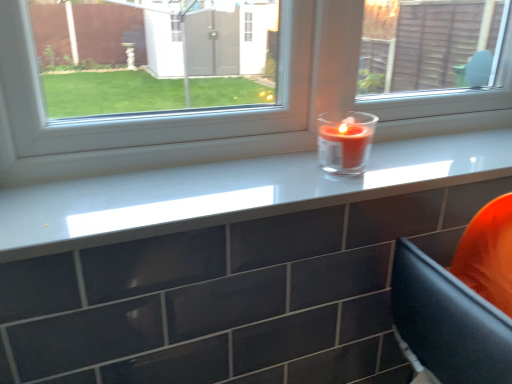
Question: From a real-world perspective, is transparent glass candle at center positioned under matte glass candle at upper center based on gravity?

Choices:
 (A) yes
 (B) no

Answer: (B)

Question: Is transparent glass candle at center bigger than matte glass candle at upper center?

Choices:
 (A) no
 (B) yes

Answer: (B)

Question: Is transparent glass candle at center not inside matte glass candle at upper center?

Choices:
 (A) yes
 (B) no

Answer: (A)

Question: Is transparent glass candle at center beside matte glass candle at upper center?

Choices:
 (A) yes
 (B) no

Answer: (B)

Question: Is transparent glass candle at center looking in the opposite direction of matte glass candle at upper center?

Choices:
 (A) no
 (B) yes

Answer: (A)

Question: Considering the positions of transparent glass candle at center and translucent glass candle at center in the image, is transparent glass candle at center bigger or smaller than translucent glass candle at center?

Choices:
 (A) big
 (B) small

Answer: (A)

Question: From the image's perspective, relative to translucent glass candle at center, is transparent glass candle at center above or below?

Choices:
 (A) above
 (B) below

Answer: (A)

Question: From a real-world perspective, is transparent glass candle at center physically located above or below translucent glass candle at center?

Choices:
 (A) above
 (B) below

Answer: (A)

Question: Considering the positions of transparent glass candle at center and translucent glass candle at center in the image, is transparent glass candle at center wider or thinner than translucent glass candle at center?

Choices:
 (A) wide
 (B) thin

Answer: (B)

Question: Visually, is matte glass candle at upper center positioned to the left or to the right of transparent glass candle at center?

Choices:
 (A) left
 (B) right

Answer: (B)

Question: Considering the positions of point (261, 165) and point (135, 137), is point (261, 165) closer or farther from the camera than point (135, 137)?

Choices:
 (A) closer
 (B) farther

Answer: (B)

Question: From the image's perspective, is matte glass candle at upper center located above or below transparent glass candle at center?

Choices:
 (A) above
 (B) below

Answer: (B)

Question: From a real-world perspective, is matte glass candle at upper center above or below transparent glass candle at center?

Choices:
 (A) above
 (B) below

Answer: (B)

Question: Does point (50, 139) appear closer or farther from the camera than point (195, 220)?

Choices:
 (A) closer
 (B) farther

Answer: (B)

Question: Based on their sizes in the image, would you say transparent glass candle at center is bigger or smaller than matte glass candle at upper center?

Choices:
 (A) small
 (B) big

Answer: (B)